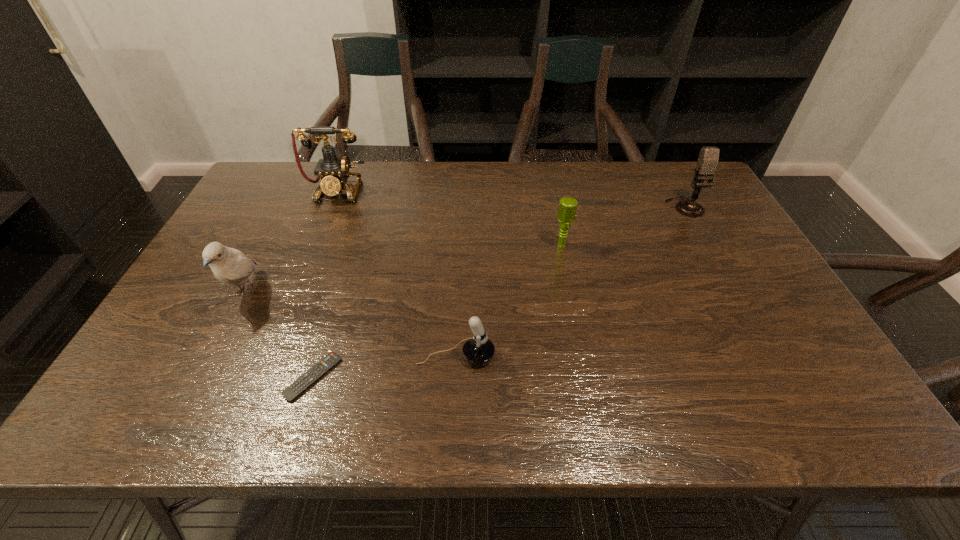
Find the location of a particular element. blank space located 0.280m on the front-facing side of the farthest microphone is located at coordinates (727, 283).

Where is `free region located 0.280m at the beak of the fourth farthest object`? This screenshot has height=540, width=960. free region located 0.280m at the beak of the fourth farthest object is located at coordinates (179, 427).

In order to click on vacant space located 0.100m on the left of the second microphone from left to right in this screenshot , I will do `click(518, 246)`.

This screenshot has height=540, width=960. I want to click on vacant space located 0.110m on the back of the leftmost microphone, so click(x=458, y=308).

The height and width of the screenshot is (540, 960). Find the location of `vacant space located on the back of the remote control`. vacant space located on the back of the remote control is located at coordinates coord(326,335).

The width and height of the screenshot is (960, 540). Identify the location of telephone located in the far edge section of the desktop. (334, 172).

Find the location of a particular element. The width and height of the screenshot is (960, 540). microphone situated at the far edge is located at coordinates (708, 158).

I want to click on object located at the near edge, so click(291, 393).

Image resolution: width=960 pixels, height=540 pixels. I want to click on object present at the left edge, so click(230, 266).

Where is `object at the right edge`? The width and height of the screenshot is (960, 540). object at the right edge is located at coordinates (708, 158).